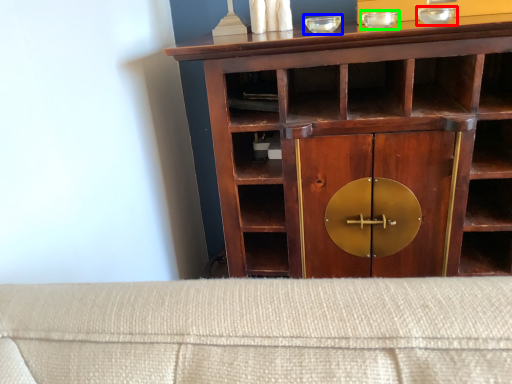
Question: Which object is the farthest from glass bowl (highlighted by a red box)? Choose among these: glass bowl (highlighted by a blue box) or glass bowl (highlighted by a green box).

Choices:
 (A) glass bowl
 (B) glass bowl

Answer: (A)